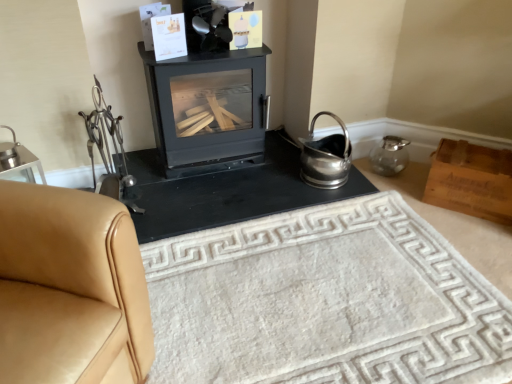
Locate an element on the screen. vacant region in front of black matte wood burning stove at center is located at coordinates (211, 193).